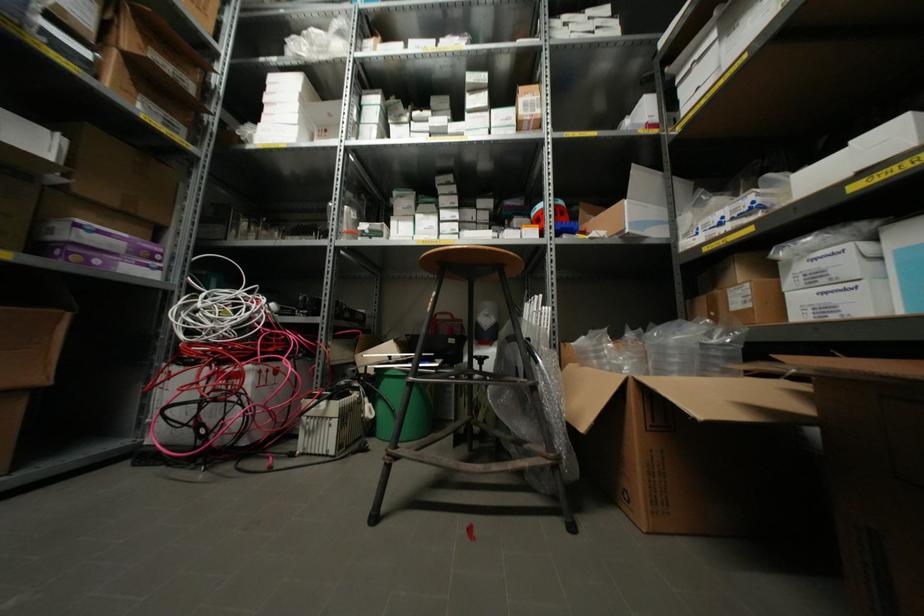
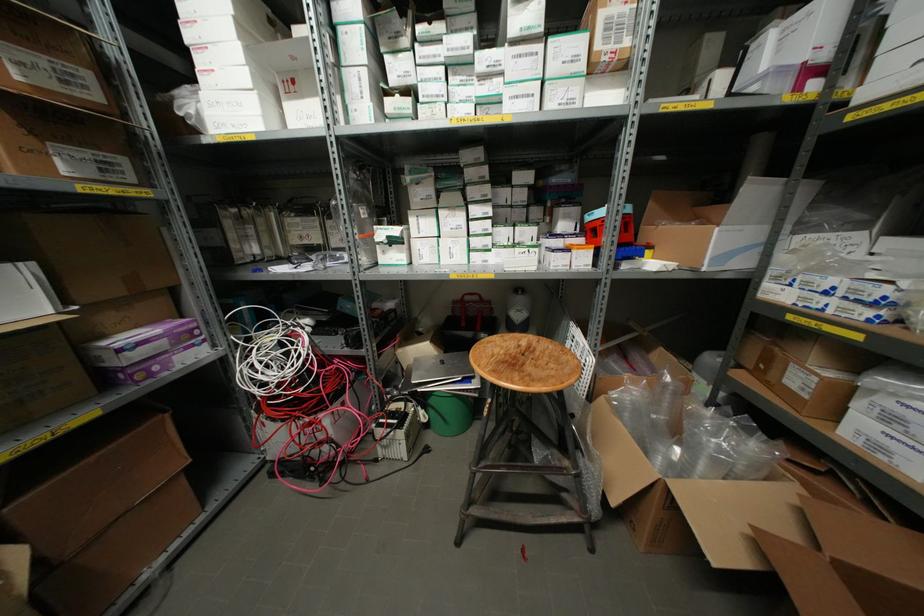
Where in the second image is the point corresponding to the point at 294,135 from the first image?

(257, 111)